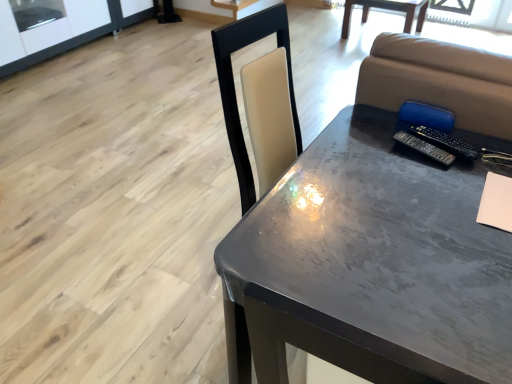
Where is `unoccupied space behind black plastic remote at right, which appears as the first remote when viewed from the left`? This screenshot has width=512, height=384. unoccupied space behind black plastic remote at right, which appears as the first remote when viewed from the left is located at coordinates (381, 124).